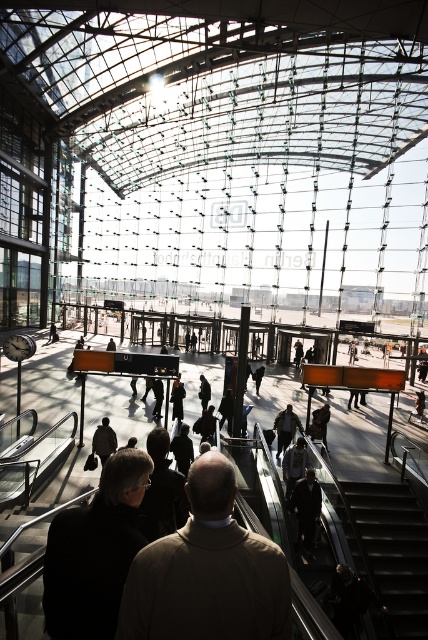
Does black matte jacket at lower left have a lesser height compared to dark gray sweater at center?

No.

Can you confirm if black matte jacket at lower left is positioned to the right of dark gray sweater at center?

Incorrect, black matte jacket at lower left is not on the right side of dark gray sweater at center.

Is point (113, 589) positioned in front of point (297, 477)?

That is True.

Identify the location of black matte jacket at lower left. This screenshot has height=640, width=428. tap(95, 552).

Is light brown leather jacket at center to the right of dark gray jacket at center from the viewer's perspective?

No, light brown leather jacket at center is not to the right of dark gray jacket at center.

Is point (142, 637) more distant than point (288, 438)?

No.

Is point (205, 625) positioned in front of point (300, 422)?

Yes, it is in front of point (300, 422).

I want to click on light brown leather jacket at center, so click(x=208, y=572).

Does light brown leather jacket at center have a greater width compared to dark gray sweater at center?

Correct, the width of light brown leather jacket at center exceeds that of dark gray sweater at center.

Who is more forward, (213, 600) or (285, 497)?

Point (213, 600)

Find the location of `light brown leather jacket at center`. light brown leather jacket at center is located at coordinates (208, 572).